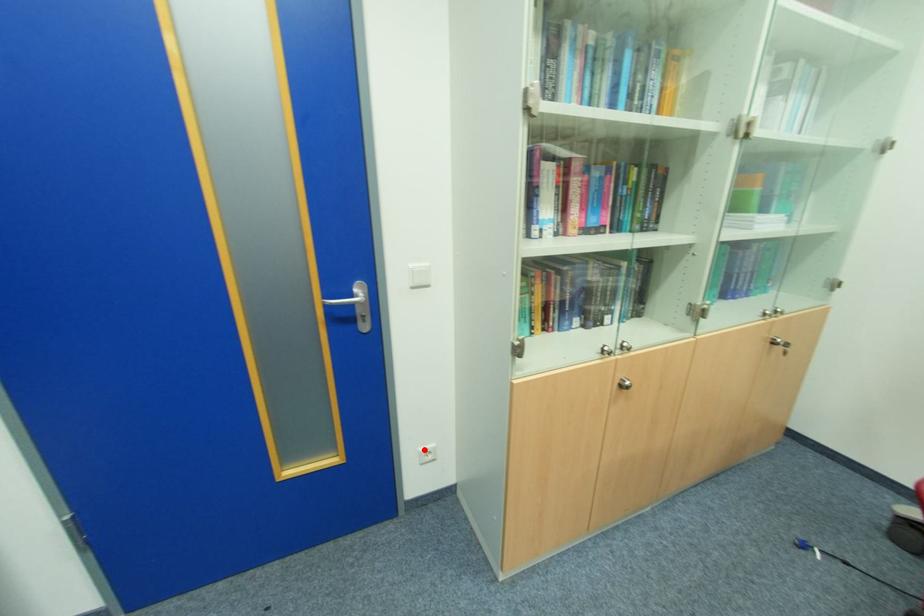
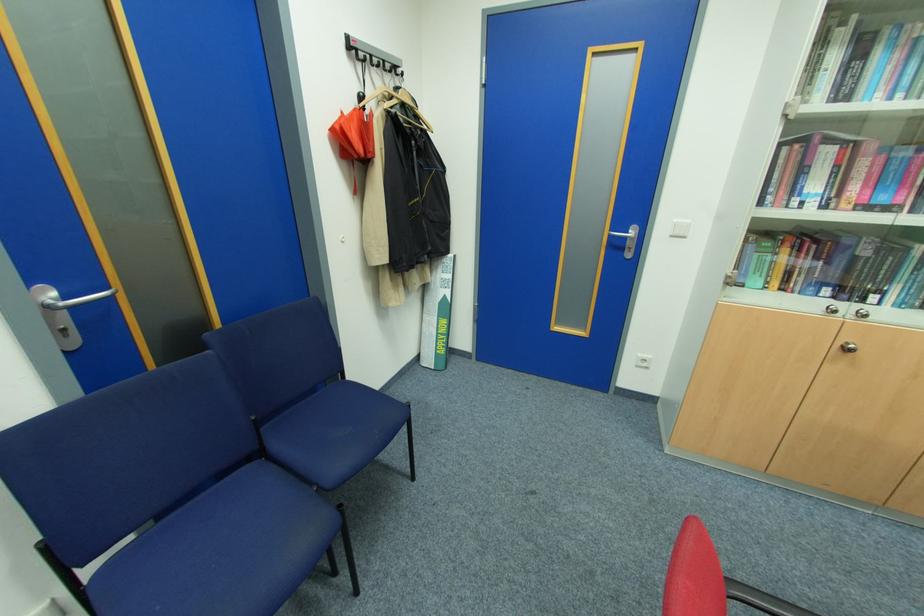
Question: A red point is marked in image1. In image2, is the corresponding 3D point closer to the camera or farther? Reply with the corresponding letter.

Choices:
 (A) The corresponding 3D point is closer.
 (B) The corresponding 3D point is farther.

Answer: (B)